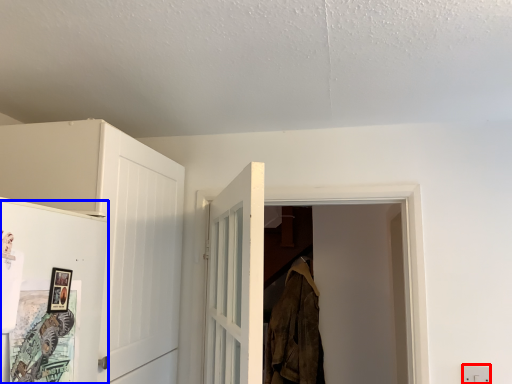
Question: Among these objects, which one is farthest to the camera, electric outlet (highlighted by a red box) or door (highlighted by a blue box)?

Choices:
 (A) electric outlet
 (B) door

Answer: (A)